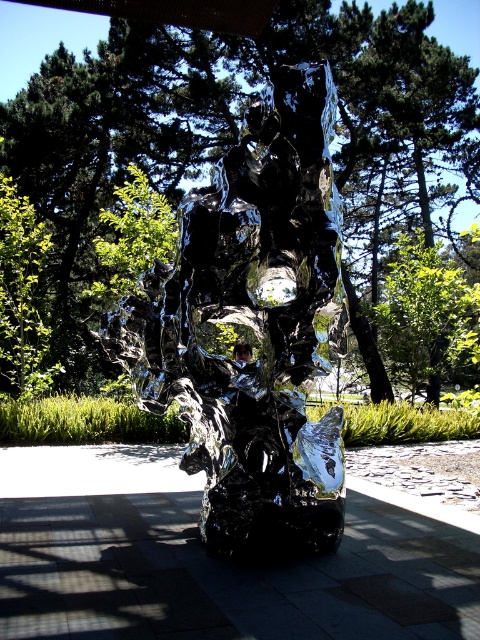
Question: Which of the following is the closest to the observer?

Choices:
 (A) green leafy tree at center
 (B) shiny metallic sculpture at center

Answer: (B)

Question: Can you confirm if glossy metallic tree at center is positioned to the left of shiny metallic sculpture at center?

Choices:
 (A) yes
 (B) no

Answer: (A)

Question: Is glossy metallic tree at center to the right of green leafy tree at center from the viewer's perspective?

Choices:
 (A) no
 (B) yes

Answer: (A)

Question: Which of the following is the farthest from the observer?

Choices:
 (A) glossy metallic tree at center
 (B) shiny metallic sculpture at center
 (C) green leafy tree at center

Answer: (C)

Question: From the image, what is the correct spatial relationship of shiny metallic sculpture at center in relation to green leafy tree at center?

Choices:
 (A) right
 (B) left

Answer: (B)

Question: Which object is positioned closest to the glossy metallic tree at center?

Choices:
 (A) shiny metallic sculpture at center
 (B) green leafy tree at center

Answer: (B)